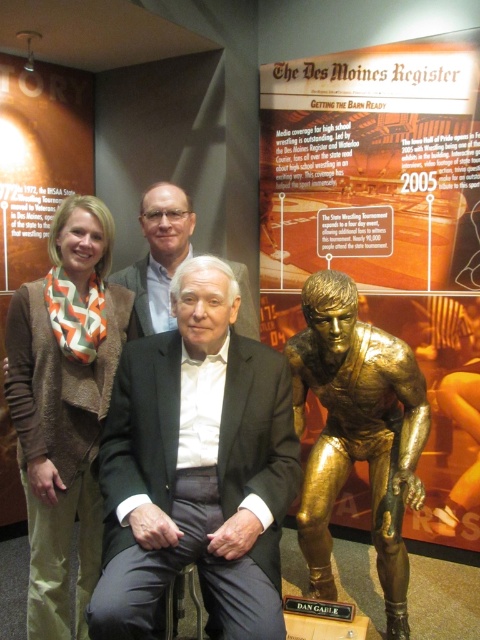
You are a photographer adjusting the camera settings to ensure both suits are in focus. Given that the matte black suit at center is taller than the white textured suit at center, which suit should you focus on first to ensure depth of field captures both?

Since the matte black suit at center is taller than the white textured suit at center, you should focus on the matte black suit at center first. This ensures the depth of field will include both suits as the taller one is further back, maintaining focus on both by starting with the farther subject.

You are a photographer trying to adjust your focus for a group photo. You have two points in the image to focus on, point (x=375, y=449) and point (x=135, y=268). Which point should you focus on first to ensure the closest subject is sharp?

Point (x=375, y=449) is closer to the camera than point (x=135, y=268), so you should focus on point (x=375, y=449) first to ensure the closest subject is sharp.

You are standing in front of the display board about high school wrestling. There is a point marked at coordinates (386, 227). Where is this point located?

The point (386, 227) is located on the gold statue at right.